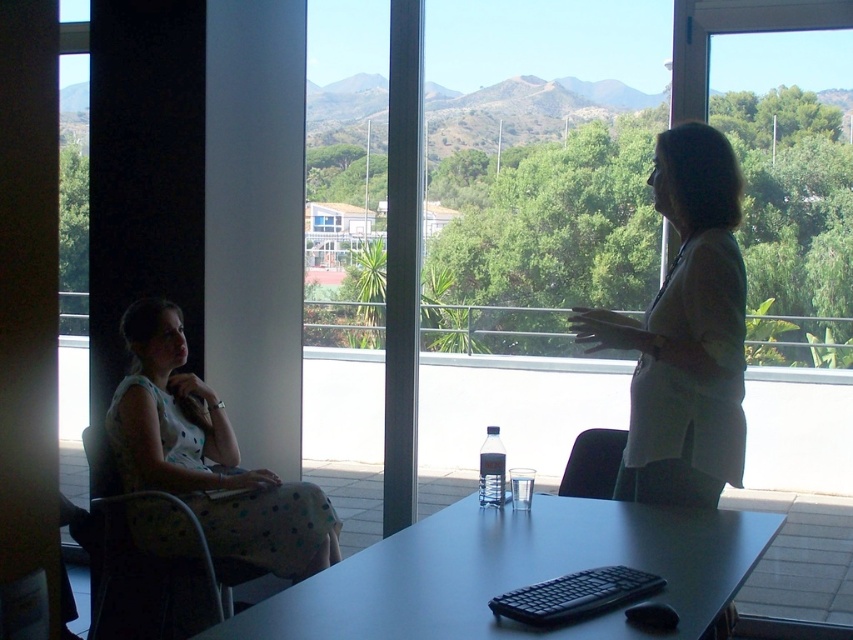
Question: Among these objects, which one is nearest to the camera?

Choices:
 (A) white fabric shirt at upper right
 (B) transparent glass window at upper right
 (C) black plastic chair at lower center
 (D) smooth matte black table at center

Answer: (D)

Question: Does white dotted dress at left have a smaller size compared to transparent glass window at upper right?

Choices:
 (A) no
 (B) yes

Answer: (A)

Question: Which point is closer to the camera taking this photo?

Choices:
 (A) (689, 28)
 (B) (152, 595)

Answer: (B)

Question: Among these points, which one is farthest from the camera?

Choices:
 (A) (465, 538)
 (B) (131, 440)
 (C) (604, 467)

Answer: (C)

Question: Can you confirm if polka dot fabric chair at left is positioned to the right of transparent glass window at upper right?

Choices:
 (A) yes
 (B) no

Answer: (B)

Question: Is white fabric shirt at upper right wider than polka dot fabric chair at left?

Choices:
 (A) yes
 (B) no

Answer: (B)